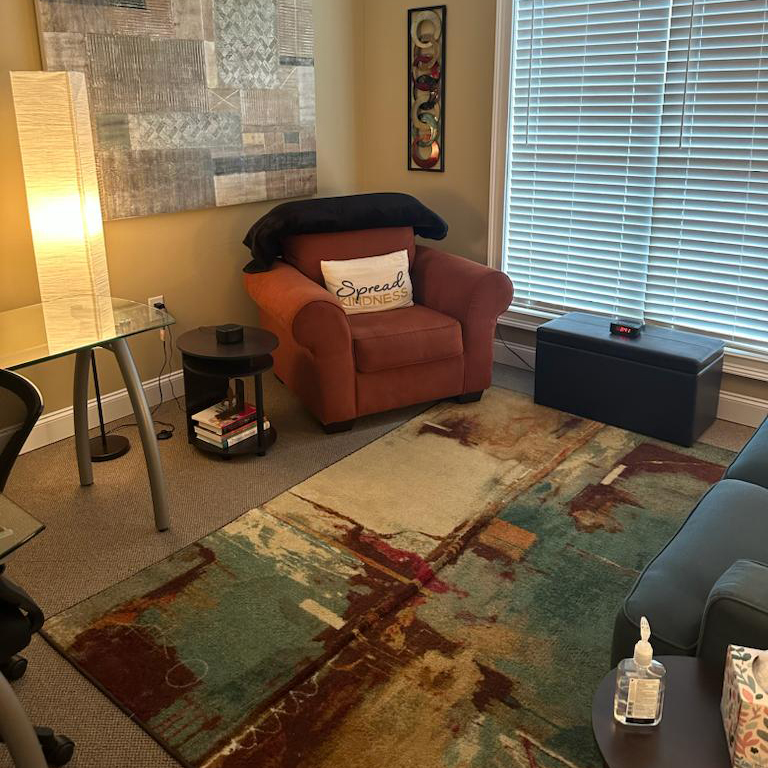
The image size is (768, 768). I want to click on gray sofa, so click(682, 581).